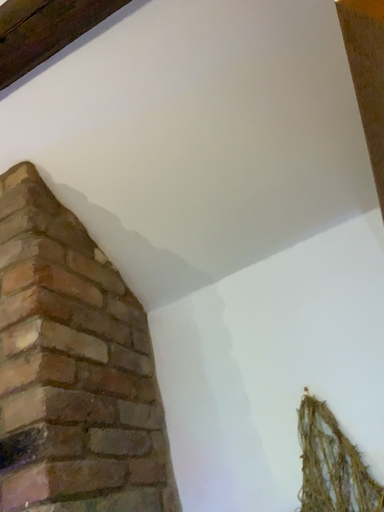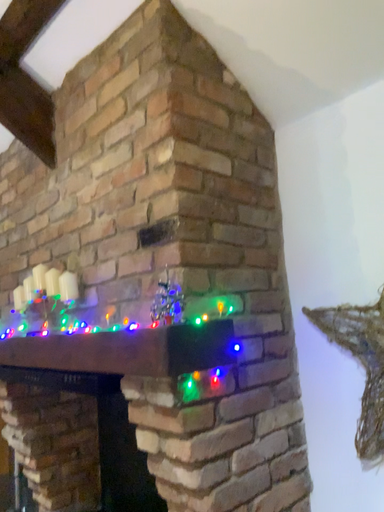
Question: How did the camera likely rotate when shooting the video?

Choices:
 (A) rotated left
 (B) rotated right

Answer: (A)